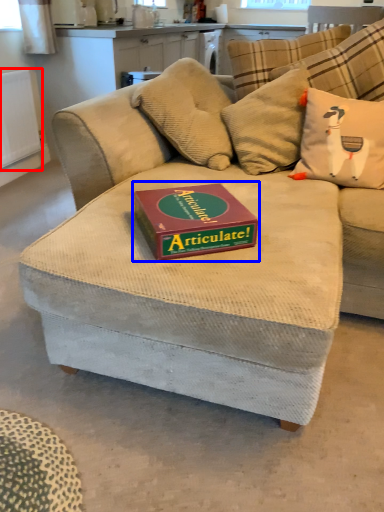
Question: Which object is further to the camera taking this photo, radiator (highlighted by a red box) or paperback book (highlighted by a blue box)?

Choices:
 (A) radiator
 (B) paperback book

Answer: (A)